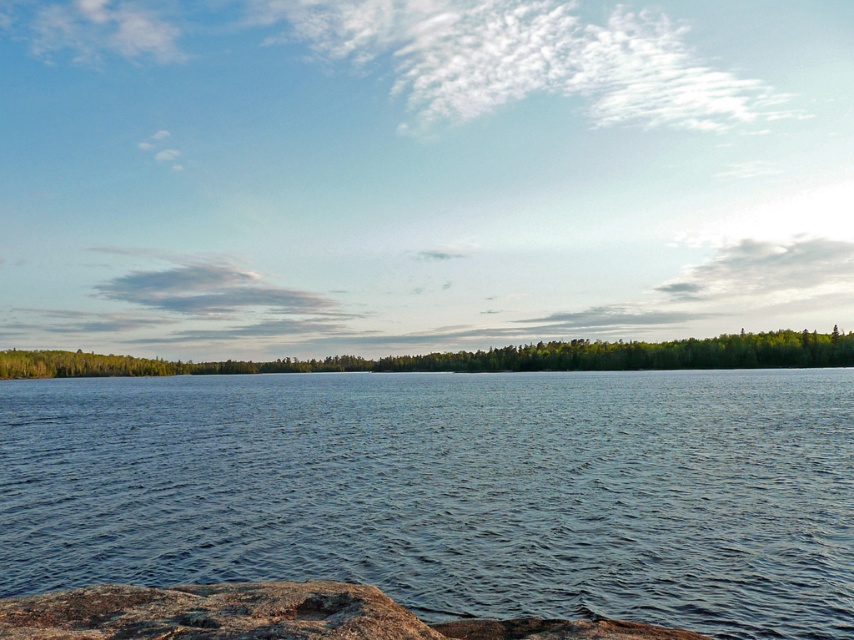
Looking at this image, you are a painter setting up your easel to capture the lakeside scene. You want to focus on the brown rough rock at lower left and the green matte tree at center. Which object should you place closer to the edge of your canvas to maintain balance?

Since the brown rough rock at lower left occupies less space than the green matte tree at center, you should place the brown rough rock at lower left closer to the edge to balance the composition, as smaller elements are often positioned at the edges to counterbalance larger ones.

You are an artist planning to paint the lakeside scene. You have two canvases of the same size. You want to paint the blue water at center and the green matte tree at center on separate canvases. Which object will require a smaller canvas to capture its full view?

The blue water at center requires a smaller canvas because it is smaller than the green matte tree at center.